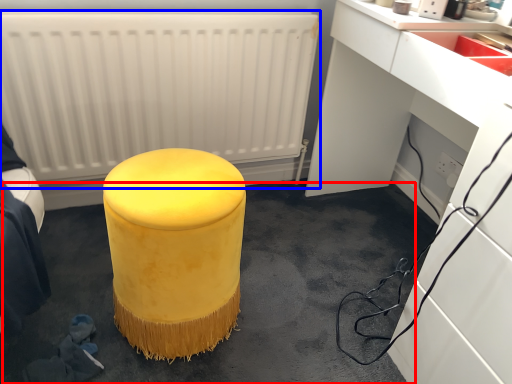
Question: Which object is further to the camera taking this photo, concrete (highlighted by a red box) or radiator (highlighted by a blue box)?

Choices:
 (A) concrete
 (B) radiator

Answer: (B)